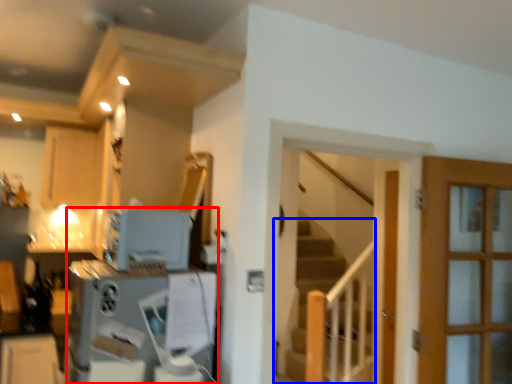
Question: Which of the following is the closest to the observer, appliance (highlighted by a red box) or stairs (highlighted by a blue box)?

Choices:
 (A) appliance
 (B) stairs

Answer: (A)